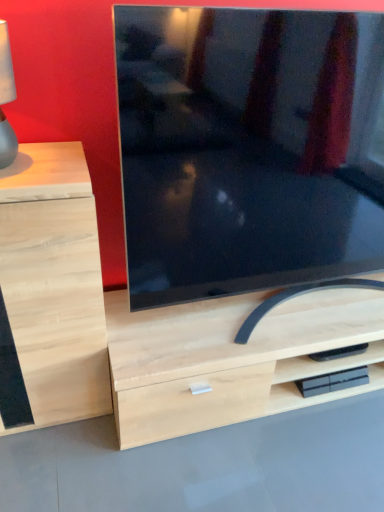
Identify the location of empty space that is to the right of matte gray lampshade at left. This screenshot has height=512, width=384. (58, 164).